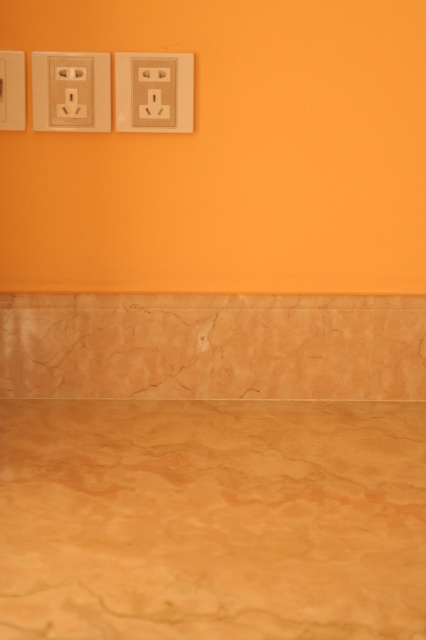
Question: Estimate the real-world distances between objects in this image. Which object is farther from the marble countertop at lower center?

Choices:
 (A) matte beige outlet at upper left
 (B) beige plastic outlet at upper left

Answer: (A)

Question: Among these points, which one is farthest from the camera?

Choices:
 (A) (123, 108)
 (B) (97, 416)

Answer: (B)

Question: Does beige plastic outlet at upper left have a lesser width compared to beige plastic outlet at upper center?

Choices:
 (A) no
 (B) yes

Answer: (A)

Question: Which object is the closest to the marble countertop at lower center?

Choices:
 (A) beige plastic outlet at upper left
 (B) beige plastic outlet at upper center
 (C) matte beige outlet at upper left

Answer: (B)

Question: Can you confirm if marble countertop at lower center is bigger than beige plastic outlet at upper center?

Choices:
 (A) no
 (B) yes

Answer: (B)

Question: Can you confirm if beige plastic outlet at upper center is wider than matte beige outlet at upper left?

Choices:
 (A) yes
 (B) no

Answer: (A)